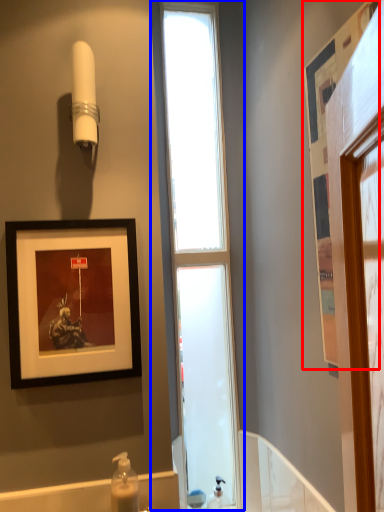
Question: Which of the following is the closest to the observer, picture frame (highlighted by a red box) or window (highlighted by a blue box)?

Choices:
 (A) picture frame
 (B) window

Answer: (A)